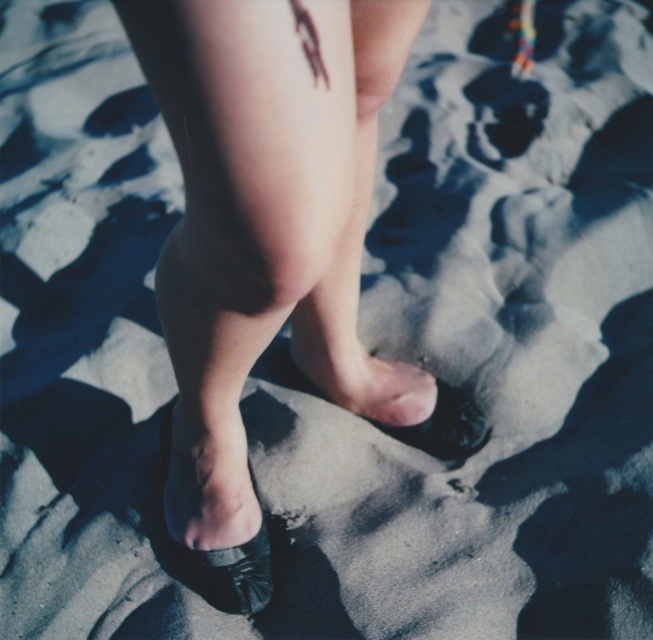
You are a photographer trying to capture the texture of the sand dunes. You notice the matte black shoe at center and the smooth skin leg at center in your frame. Which object is closer to you, the photographer?

The matte black shoe at center is closer to the viewer than the smooth skin leg at center, so the photographer should focus on the matte black shoe at center to capture the texture details more clearly.